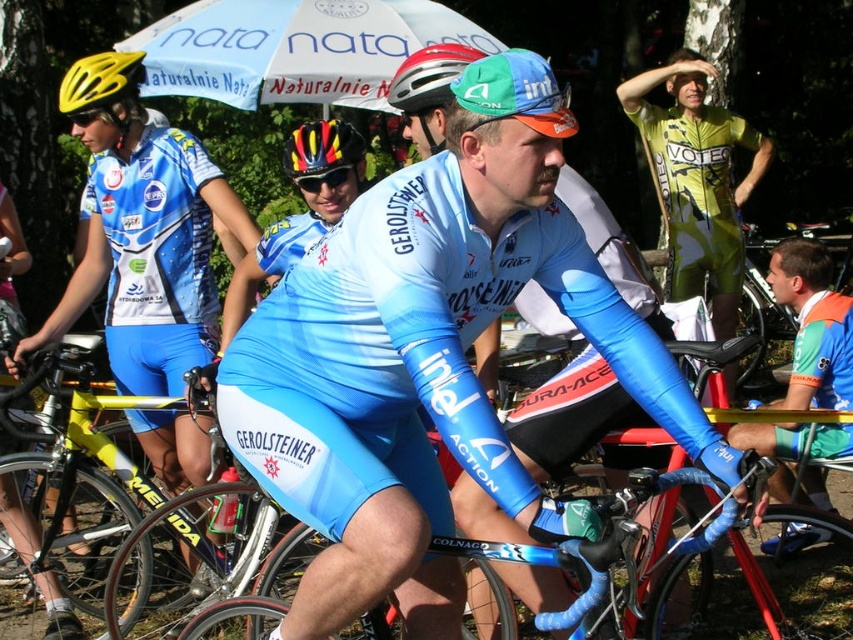
Can you confirm if blue jersey at center is thinner than yellow/black/red matte bicycle helmet at center?

Incorrect, blue jersey at center's width is not less than yellow/black/red matte bicycle helmet at center's.

Image resolution: width=853 pixels, height=640 pixels. I want to click on blue jersey at center, so click(x=430, y=356).

What do you see at coordinates (430, 356) in the screenshot? This screenshot has height=640, width=853. I see `blue jersey at center` at bounding box center [430, 356].

You are a GUI agent. You are given a task and a screenshot of the screen. Output one action in this format:
    pyautogui.click(x=<x>, y=<y>)
    Task: Click on the blue jersey at center
    Image resolution: width=853 pixels, height=640 pixels.
    Given the screenshot: What is the action you would take?
    pyautogui.click(x=430, y=356)

Who is positioned more to the right, matte blue helmet at center or yellow/black/red matte bicycle helmet at center?

Positioned to the right is matte blue helmet at center.

Does matte blue helmet at center appear under yellow/black/red matte bicycle helmet at center?

No, matte blue helmet at center is not below yellow/black/red matte bicycle helmet at center.

Between point (440, 81) and point (289, 140), which one is positioned in front?

Point (440, 81)

At what (x,y) coordinates should I click in order to perform the action: click on matte blue helmet at center. Please return your answer as a coordinate pair (x, y). Image resolution: width=853 pixels, height=640 pixels. Looking at the image, I should click on (428, 76).

Does matte blue jersey at center have a lesser width compared to yellow matte helmet at upper left?

No, matte blue jersey at center is not thinner than yellow matte helmet at upper left.

Does matte blue jersey at center have a larger size compared to yellow matte helmet at upper left?

Yes, matte blue jersey at center is bigger than yellow matte helmet at upper left.

Which is in front, point (164, 237) or point (119, 67)?

Point (119, 67) is in front.

Where is `matte blue jersey at center`? matte blue jersey at center is located at coordinates (148, 250).